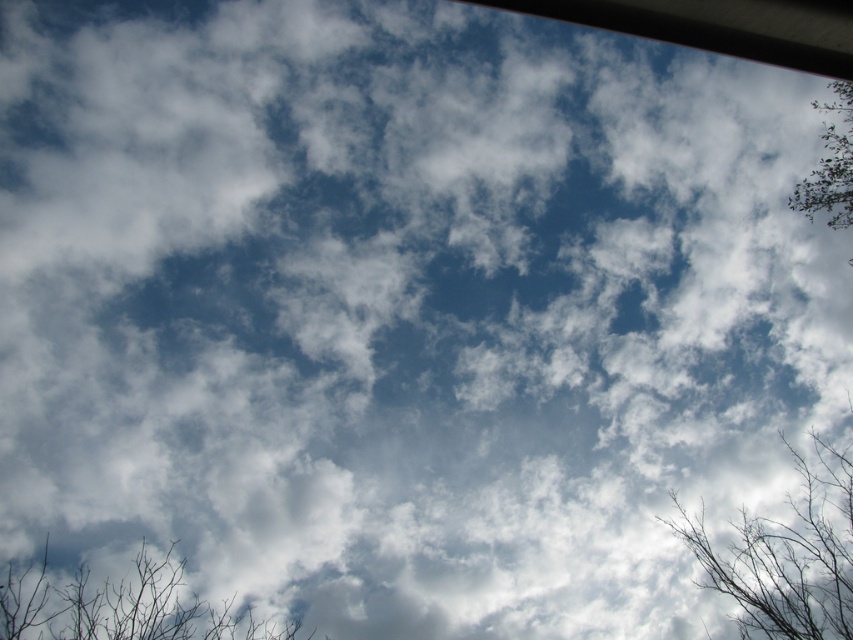
Who is lower down, bare branches at lower right or brown/dry wood tree at lower left?

brown/dry wood tree at lower left

Between bare branches at lower right and brown/dry wood tree at lower left, which one appears on the left side from the viewer's perspective?

Positioned to the left is brown/dry wood tree at lower left.

Who is more distant from viewer, (833, 474) or (218, 625)?

Positioned behind is point (833, 474).

The image size is (853, 640). Find the location of `bare branches at lower right`. bare branches at lower right is located at coordinates (787, 554).

Is the position of bare branches at lower right more distant than that of green leafy tree at upper right?

No, it is in front of green leafy tree at upper right.

Is bare branches at lower right wider than green leafy tree at upper right?

Yes.

Is point (775, 592) more distant than point (831, 163)?

No, (775, 592) is closer to viewer.

Locate an element on the screen. This screenshot has height=640, width=853. bare branches at lower right is located at coordinates (787, 554).

Is point (68, 616) closer to viewer compared to point (849, 172)?

Yes, point (68, 616) is in front of point (849, 172).

At what (x,y) coordinates should I click in order to perform the action: click on brown/dry wood tree at lower left. Please return your answer as a coordinate pair (x, y). This screenshot has width=853, height=640. Looking at the image, I should click on (123, 605).